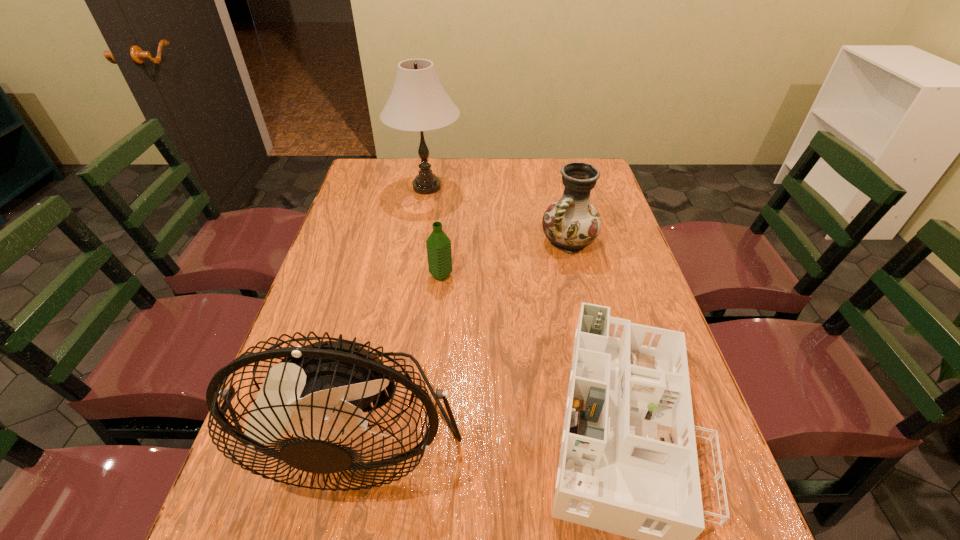
The width and height of the screenshot is (960, 540). I want to click on lamp positioned at the left edge, so click(x=418, y=102).

Find the location of `fan that is at the left edge`. fan that is at the left edge is located at coordinates (322, 390).

Locate an element on the screen. The height and width of the screenshot is (540, 960). object at the right edge is located at coordinates (572, 223).

I want to click on object located in the far left corner section of the desktop, so click(x=418, y=102).

The image size is (960, 540). What are the coordinates of `vacant space at the far edge of the desktop` in the screenshot? It's located at (416, 178).

The height and width of the screenshot is (540, 960). Identify the location of vacant space at the left edge of the desktop. (332, 272).

What are the coordinates of `blank space at the right edge of the desktop` in the screenshot? It's located at (645, 319).

This screenshot has width=960, height=540. I want to click on vacant space at the far right corner of the desktop, so click(x=562, y=167).

You are a GUI agent. You are given a task and a screenshot of the screen. Output one action in this format:
    pyautogui.click(x=<x>, y=<y>)
    Task: Click on the empty location between the lamp and the fan
    
    Given the screenshot: What is the action you would take?
    pyautogui.click(x=394, y=307)

Locate an element on the screen. The width and height of the screenshot is (960, 540). free space between the second shortest object and the third shortest object is located at coordinates (505, 259).